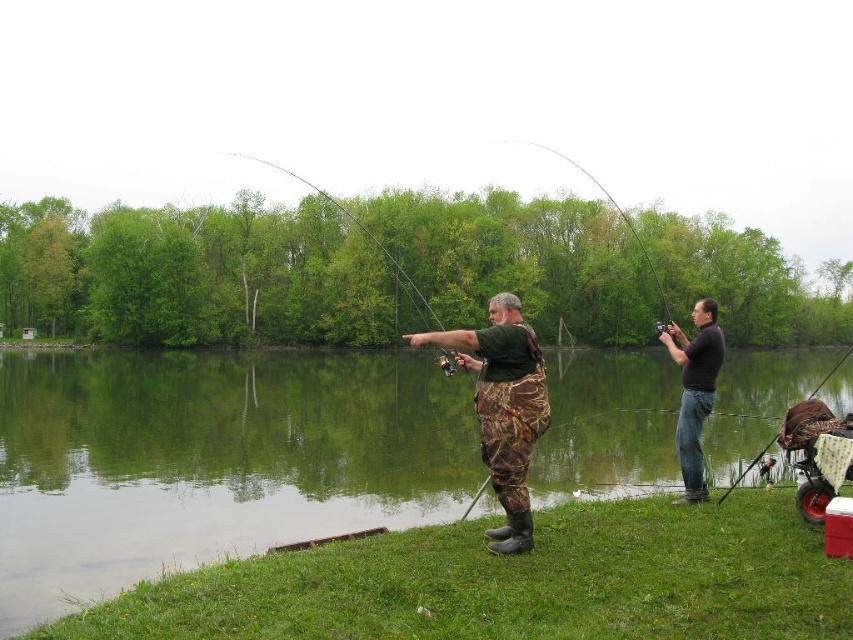
Question: Which object appears farthest from the camera in this image?

Choices:
 (A) green smooth water at center
 (B) camouflage fabric fishing rod at center
 (C) black matte shirt at right

Answer: (C)

Question: Which of the following is the closest to the observer?

Choices:
 (A) camouflage pants at center
 (B) matte black fishing pole at right
 (C) shiny metallic rod at upper center

Answer: (A)

Question: Is black matte shirt at right below shiny metallic rod at upper center?

Choices:
 (A) no
 (B) yes

Answer: (B)

Question: Which point appears closest to the camera in this image?

Choices:
 (A) (485, 368)
 (B) (640, 248)
 (C) (601, 355)

Answer: (A)

Question: Does camouflage fabric fishing rod at center have a lesser width compared to shiny metallic rod at upper center?

Choices:
 (A) yes
 (B) no

Answer: (B)

Question: Does camouflage pants at center appear on the right side of shiny metallic rod at upper center?

Choices:
 (A) yes
 (B) no

Answer: (B)